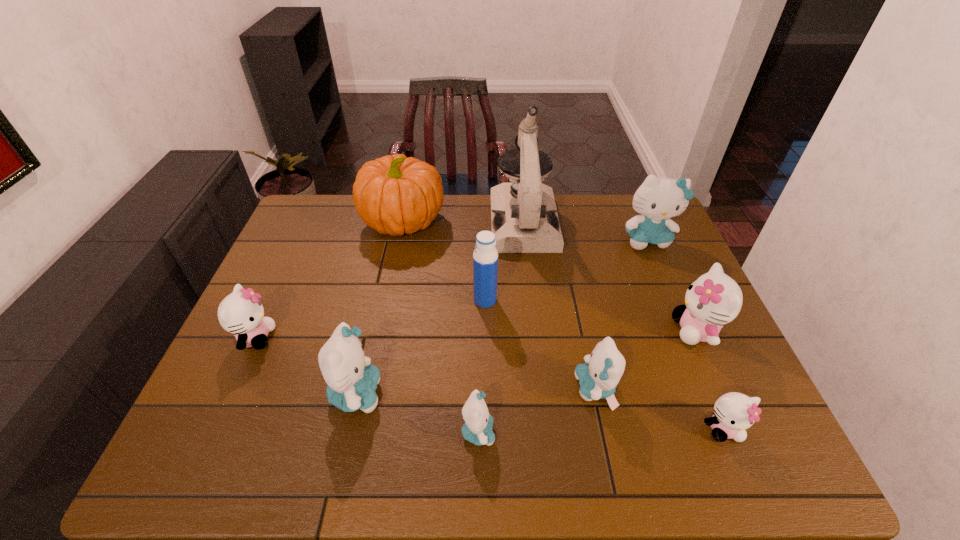
Locate an element on the screen. kitten that stands as the fifth closest to the rightmost blue kitten is located at coordinates (351, 380).

Where is `blue kitten that is the closest to the leftmost blue kitten`? blue kitten that is the closest to the leftmost blue kitten is located at coordinates (477, 429).

I want to click on blue kitten identified as the second closest to the second blue kitten from left to right, so click(598, 378).

You are a GUI agent. You are given a task and a screenshot of the screen. Output one action in this format:
    pyautogui.click(x=<x>, y=<y>)
    Task: Click on the white kitten that can be found as the second closest to the second blue kitten from right to left
    The width and height of the screenshot is (960, 540).
    Given the screenshot: What is the action you would take?
    pyautogui.click(x=714, y=299)

Image resolution: width=960 pixels, height=540 pixels. Find the location of `white kitten that is the second closest to the leftmost object`. white kitten that is the second closest to the leftmost object is located at coordinates (714, 299).

You are a GUI agent. You are given a task and a screenshot of the screen. Output one action in this format:
    pyautogui.click(x=<x>, y=<y>)
    Task: Click on the free space in the image that satisfies the following two spatial constraints: 1. on the face of the biggest blue kitten; 2. on the face of the second biggest blue kitten
    The image size is (960, 540).
    Given the screenshot: What is the action you would take?
    pyautogui.click(x=713, y=394)

You are a GUI agent. You are given a task and a screenshot of the screen. Output one action in this format:
    pyautogui.click(x=<x>, y=<y>)
    Task: Click on the free location that satisfies the following two spatial constraints: 1. on the surface of the blue water bottle; 2. on the left side of the pumpkin
    This screenshot has height=540, width=960.
    Given the screenshot: What is the action you would take?
    pyautogui.click(x=388, y=300)